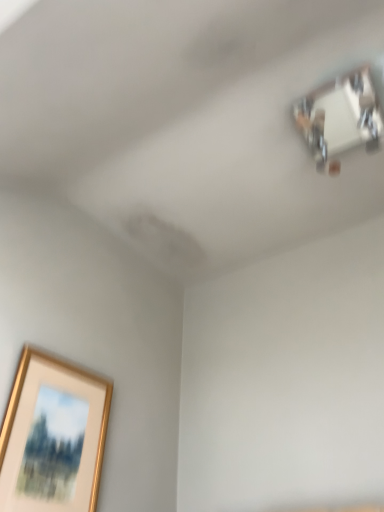
Question: Would you say gold metallic picture frame at lower left is inside or outside metallic reflective mirror at upper right?

Choices:
 (A) outside
 (B) inside

Answer: (A)

Question: From the image's perspective, relative to metallic reflective mirror at upper right, is gold metallic picture frame at lower left above or below?

Choices:
 (A) above
 (B) below

Answer: (B)

Question: Visually, is gold metallic picture frame at lower left positioned to the left or to the right of metallic reflective mirror at upper right?

Choices:
 (A) left
 (B) right

Answer: (A)

Question: Based on their sizes in the image, would you say metallic reflective mirror at upper right is bigger or smaller than gold metallic picture frame at lower left?

Choices:
 (A) small
 (B) big

Answer: (B)

Question: From a real-world perspective, is metallic reflective mirror at upper right physically located above or below gold metallic picture frame at lower left?

Choices:
 (A) above
 (B) below

Answer: (A)

Question: Is metallic reflective mirror at upper right inside the boundaries of gold metallic picture frame at lower left, or outside?

Choices:
 (A) outside
 (B) inside

Answer: (A)

Question: In terms of width, does metallic reflective mirror at upper right look wider or thinner when compared to gold metallic picture frame at lower left?

Choices:
 (A) thin
 (B) wide

Answer: (B)